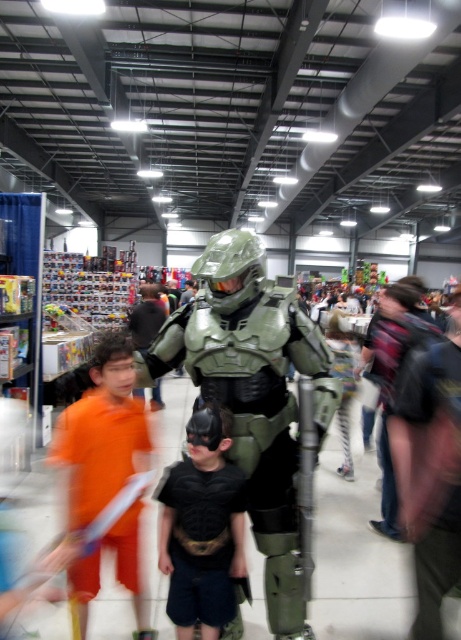
Question: Considering the relative positions of green matte armor at center and dark brown leather backpack at center right in the image provided, where is green matte armor at center located with respect to dark brown leather backpack at center right?

Choices:
 (A) below
 (B) above

Answer: (A)

Question: Which point is farther to the camera?

Choices:
 (A) (444, 506)
 (B) (131, 314)
 (C) (231, 508)

Answer: (B)

Question: Can you confirm if black matte batman costume at center is wider than orange t-shirt at center?

Choices:
 (A) no
 (B) yes

Answer: (A)

Question: Which object is closer to the camera taking this photo?

Choices:
 (A) orange fabric shirt at left
 (B) green matte armor at center
 (C) orange t-shirt at center

Answer: (B)

Question: Is dark brown leather backpack at center right in front of orange t-shirt at center?

Choices:
 (A) no
 (B) yes

Answer: (B)

Question: Among these objects, which one is nearest to the camera?

Choices:
 (A) orange fabric shirt at left
 (B) black matte batman costume at center
 (C) dark brown leather backpack at center right

Answer: (C)